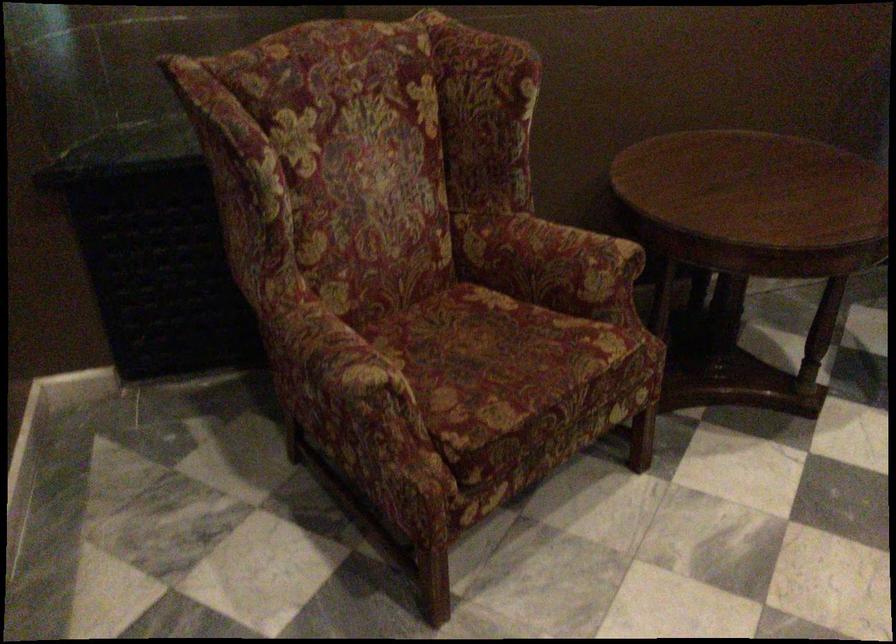
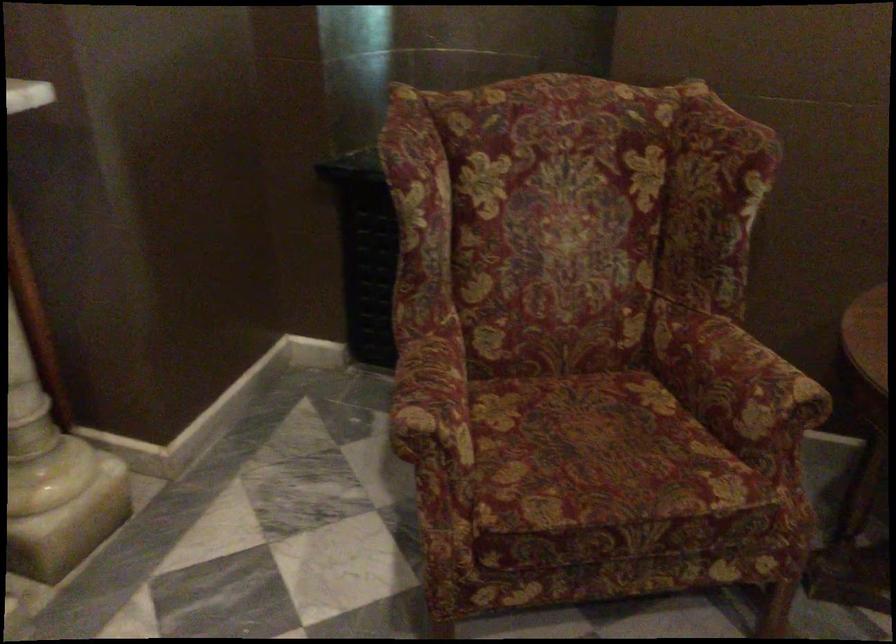
Question: Based on the continuous images, in which direction is the camera rotating? Reply with the corresponding letter.

Choices:
 (A) Left
 (B) Right
 (C) Up
 (D) Down

Answer: (A)